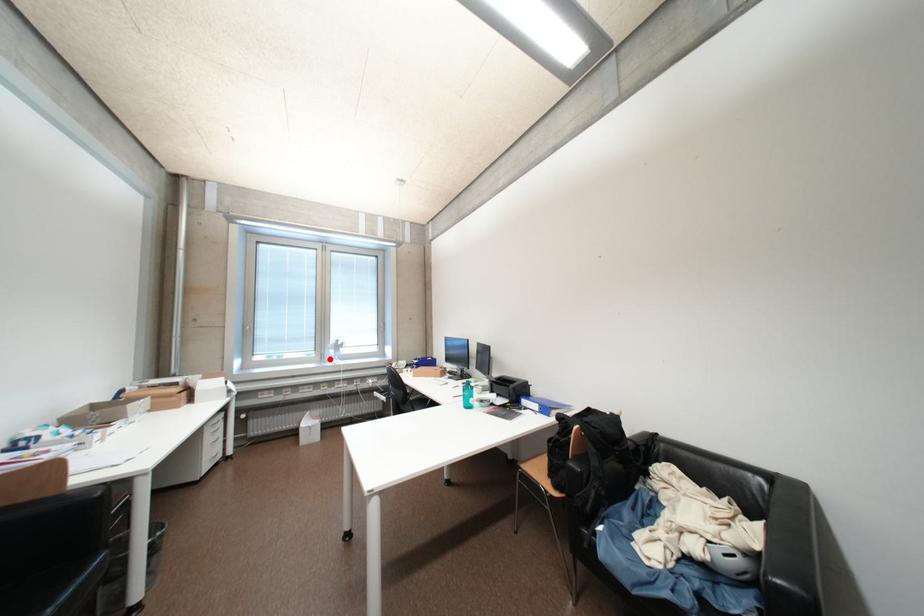
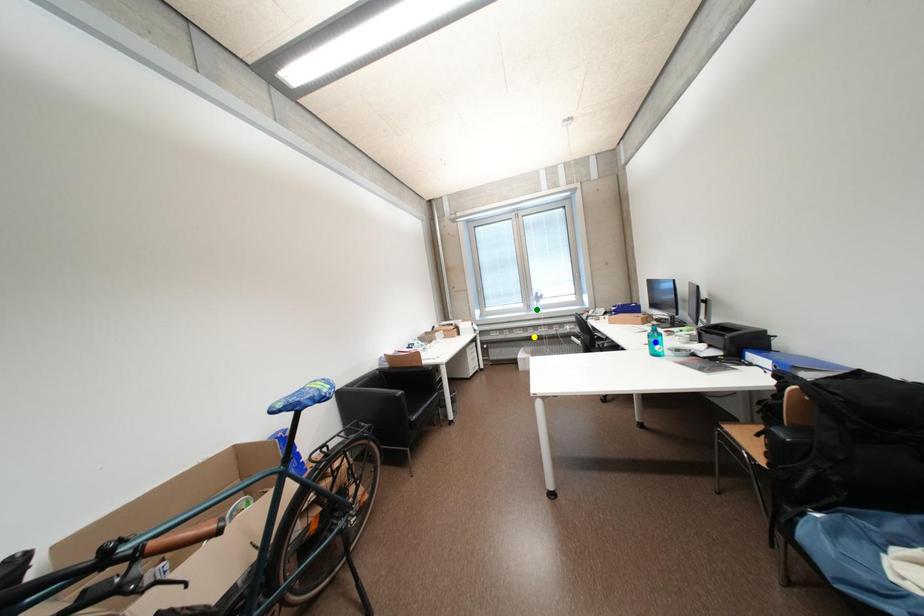
Question: I am providing you with two images of the same scene from different viewpoints. A red point is marked on the first image. You are given multiple points on the second image. Which mark in image 2 goes with the point in image 1?

Choices:
 (A) yellow point
 (B) green point
 (C) blue point

Answer: (B)